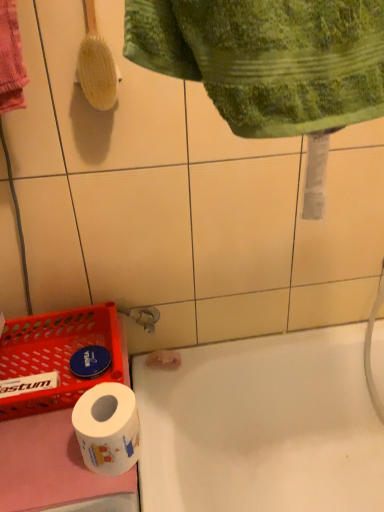
Question: Based on their positions, is yellow wooden brush at upper left located to the left or right of white glossy bathtub at lower center?

Choices:
 (A) right
 (B) left

Answer: (B)

Question: In terms of width, does yellow wooden brush at upper left look wider or thinner when compared to white glossy bathtub at lower center?

Choices:
 (A) thin
 (B) wide

Answer: (A)

Question: Estimate the real-world distances between objects in this image. Which object is farther from the white glossy toilet paper at lower left?

Choices:
 (A) yellow wooden brush at upper left
 (B) green textured towel at upper center
 (C) white glossy bathtub at lower center

Answer: (A)

Question: Estimate the real-world distances between objects in this image. Which object is farther from the white glossy toilet paper at lower left?

Choices:
 (A) green textured towel at upper center
 (B) white glossy bathtub at lower center
 (C) yellow wooden brush at upper left

Answer: (C)